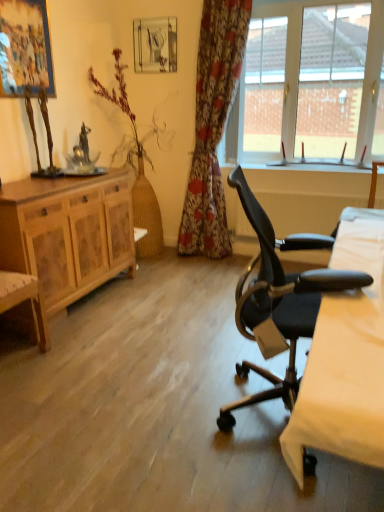
What do you see at coordinates (279, 298) in the screenshot? I see `black leather office chair at right` at bounding box center [279, 298].

What is the approximate width of metallic glass picture frame at upper center, acting as the first picture frame starting from the right?

metallic glass picture frame at upper center, acting as the first picture frame starting from the right, is 1.72 inches in width.

Locate an element on the screen. floral fabric curtain at center is located at coordinates (213, 126).

I want to click on window behind the matte wooden picture frame at upper left, the second picture frame when ordered from right to left, so pyautogui.click(x=310, y=83).

Is white glass window at upper right bigger or smaller than matte wooden picture frame at upper left, which is counted as the 2th picture frame, starting from the back?

Clearly, white glass window at upper right is larger in size than matte wooden picture frame at upper left, which is counted as the 2th picture frame, starting from the back.

Is white glass window at upper right positioned in front of matte wooden picture frame at upper left, which is counted as the first picture frame, starting from the front?

No, white glass window at upper right is further to the viewer.

Who is taller, white glass window at upper right or matte wooden picture frame at upper left, which is counted as the first picture frame, starting from the front?

With more height is white glass window at upper right.

From a real-world perspective, is matte wooden picture frame at upper left, which is counted as the 2th picture frame, starting from the back, physically located above or below black leather office chair at right?

From a real-world perspective, matte wooden picture frame at upper left, which is counted as the 2th picture frame, starting from the back, is physically above black leather office chair at right.

Is matte wooden picture frame at upper left, which is counted as the first picture frame, starting from the front, positioned with its back to black leather office chair at right?

That's not correct — matte wooden picture frame at upper left, which is counted as the first picture frame, starting from the front, is not looking away from black leather office chair at right.

Based on their sizes in the image, would you say matte wooden picture frame at upper left, the second picture frame when ordered from right to left, is bigger or smaller than black leather office chair at right?

In the image, matte wooden picture frame at upper left, the second picture frame when ordered from right to left, appears to be smaller than black leather office chair at right.

Is matte wooden picture frame at upper left, which is counted as the 2th picture frame, starting from the back, not near black leather office chair at right?

Yes.

Which object is positioned more to the left, white glass window at upper right or bare wood vase at left?

Positioned to the left is bare wood vase at left.

Is bare wood vase at left inside white glass window at upper right?

No.

Could you tell me if white glass window at upper right is turned towards bare wood vase at left?

No, white glass window at upper right is not aimed at bare wood vase at left.

From the image's perspective, which is above, white glass window at upper right or bare wood vase at left?

white glass window at upper right, from the image's perspective.

Is bare wood vase at left oriented away from floral fabric curtain at center?

Yes, bare wood vase at left is facing away from floral fabric curtain at center.

In the scene shown: From a real-world perspective, between bare wood vase at left and floral fabric curtain at center, who is vertically higher?

In real-world perspective, floral fabric curtain at center is above.

Between bare wood vase at left and floral fabric curtain at center, which one has larger size?

bare wood vase at left.

From the image's perspective, between bare wood vase at left and floral fabric curtain at center, which one is located above?

floral fabric curtain at center.

Is black leather office chair at right spatially inside floral fabric curtain at center, or outside of it?

black leather office chair at right is outside floral fabric curtain at center.

Is black leather office chair at right far from floral fabric curtain at center?

Yes, black leather office chair at right and floral fabric curtain at center are quite far apart.

Considering the relative sizes of matte wooden picture frame at upper left, arranged as the 1th picture frame when viewed from the left, and metallic glass picture frame at upper center, marked as the first picture frame in a back-to-front arrangement, in the image provided, is matte wooden picture frame at upper left, arranged as the 1th picture frame when viewed from the left, wider than metallic glass picture frame at upper center, marked as the first picture frame in a back-to-front arrangement,?

No.

Who is taller, matte wooden picture frame at upper left, which is counted as the 2th picture frame, starting from the back, or metallic glass picture frame at upper center, the second picture frame from the front?

With more height is matte wooden picture frame at upper left, which is counted as the 2th picture frame, starting from the back.

From the image's perspective, between matte wooden picture frame at upper left, which is counted as the 2th picture frame, starting from the back, and metallic glass picture frame at upper center, marked as the first picture frame in a back-to-front arrangement, who is located below?

matte wooden picture frame at upper left, which is counted as the 2th picture frame, starting from the back.

How far apart are floral fabric curtain at center and bare wood vase at left?

57.11 centimeters.

Is floral fabric curtain at center at the right side of bare wood vase at left?

Yes, floral fabric curtain at center is to the right of bare wood vase at left.

Can you confirm if floral fabric curtain at center is shorter than bare wood vase at left?

Incorrect, the height of floral fabric curtain at center does not fall short of that of bare wood vase at left.

From the image's perspective, does floral fabric curtain at center appear lower than bare wood vase at left?

Actually, floral fabric curtain at center appears above bare wood vase at left in the image.

I want to click on window on the right of the matte wooden picture frame at upper left, the second picture frame when ordered from right to left, so click(310, 83).

This screenshot has height=512, width=384. In the image, there is a matte wooden picture frame at upper left, the second picture frame when ordered from right to left. Find the location of `chair below it (from a real-world perspective)`. chair below it (from a real-world perspective) is located at coordinates (279, 298).

Considering their positions, is wooden cabinet at left positioned further to white glass window at upper right than bare wood vase at left?

bare wood vase at left is positioned further to the anchor white glass window at upper right.

Which object lies nearer to the anchor point black leather office chair at right, floral fabric curtain at center or matte wooden picture frame at upper left, the second picture frame when ordered from right to left?

Among the two, matte wooden picture frame at upper left, the second picture frame when ordered from right to left, is located nearer to black leather office chair at right.

Estimate the real-world distances between objects in this image. Which object is closer to matte wooden picture frame at upper left, arranged as the 1th picture frame when viewed from the left, bare wood vase at left or floral fabric curtain at center?

bare wood vase at left is closer to matte wooden picture frame at upper left, arranged as the 1th picture frame when viewed from the left.

Which object lies further to the anchor point bare wood vase at left, matte wooden picture frame at upper left, arranged as the 1th picture frame when viewed from the left, or metallic glass picture frame at upper center, acting as the first picture frame starting from the right?

matte wooden picture frame at upper left, arranged as the 1th picture frame when viewed from the left, lies further to bare wood vase at left than the other object.

Based on their spatial positions, is bare wood vase at left or wooden cabinet at left closer to matte wooden picture frame at upper left, arranged as the 1th picture frame when viewed from the left?

wooden cabinet at left is closer to matte wooden picture frame at upper left, arranged as the 1th picture frame when viewed from the left.

From the image, which object appears to be farther from matte wooden picture frame at upper left, the second picture frame when ordered from right to left, metallic glass picture frame at upper center, acting as the first picture frame starting from the right, or black leather office chair at right?

Among the two, black leather office chair at right is located further to matte wooden picture frame at upper left, the second picture frame when ordered from right to left.

Looking at this image, considering their positions, is black leather office chair at right positioned further to floral fabric curtain at center than white glass window at upper right?

white glass window at upper right is further to floral fabric curtain at center.

Looking at the image, which one is located closer to white glass window at upper right, black leather office chair at right or metallic glass picture frame at upper center, marked as the first picture frame in a back-to-front arrangement?

Among the two, metallic glass picture frame at upper center, marked as the first picture frame in a back-to-front arrangement, is located nearer to white glass window at upper right.

What are the coordinates of `window between black leather office chair at right and metallic glass picture frame at upper center, marked as the first picture frame in a back-to-front arrangement, along the z-axis` in the screenshot? It's located at (310, 83).

Identify the location of houseplant between black leather office chair at right and metallic glass picture frame at upper center, the second picture frame from the front, in the front-back direction. (138, 165).

The width and height of the screenshot is (384, 512). Identify the location of houseplant between matte wooden picture frame at upper left, which is counted as the first picture frame, starting from the front, and wooden cabinet at left from top to bottom. (x=138, y=165).

In order to click on curtain located between wooden cabinet at left and white glass window at upper right in the left-right direction in this screenshot , I will do `click(213, 126)`.